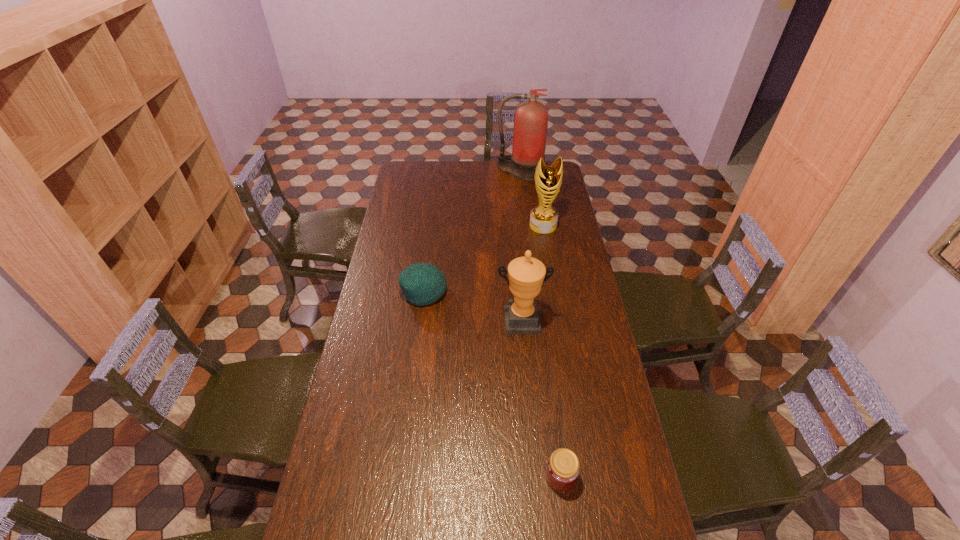
At what (x,y) coordinates should I click in order to perform the action: click on vacant region located at the front of the nearer award with handles. Please return your answer as a coordinate pair (x, y). Looking at the image, I should click on (524, 354).

Locate an element on the screen. vacant space located 0.100m on the back of the leftmost object is located at coordinates (428, 261).

Where is `free region located 0.280m on the left of the jam`? The width and height of the screenshot is (960, 540). free region located 0.280m on the left of the jam is located at coordinates (449, 477).

Locate an element on the screen. The image size is (960, 540). object that is at the far edge is located at coordinates (531, 117).

Locate an element on the screen. The height and width of the screenshot is (540, 960). object present at the left edge is located at coordinates (422, 283).

I want to click on fire extinguisher present at the right edge, so click(531, 117).

I want to click on award that is at the right edge, so click(x=543, y=218).

The height and width of the screenshot is (540, 960). Find the location of `object that is at the far right corner`. object that is at the far right corner is located at coordinates (531, 117).

In the image, there is a desktop. Identify the location of free space at the left edge. The image size is (960, 540). (377, 291).

Find the location of a particular element. free region at the right edge of the desktop is located at coordinates (633, 468).